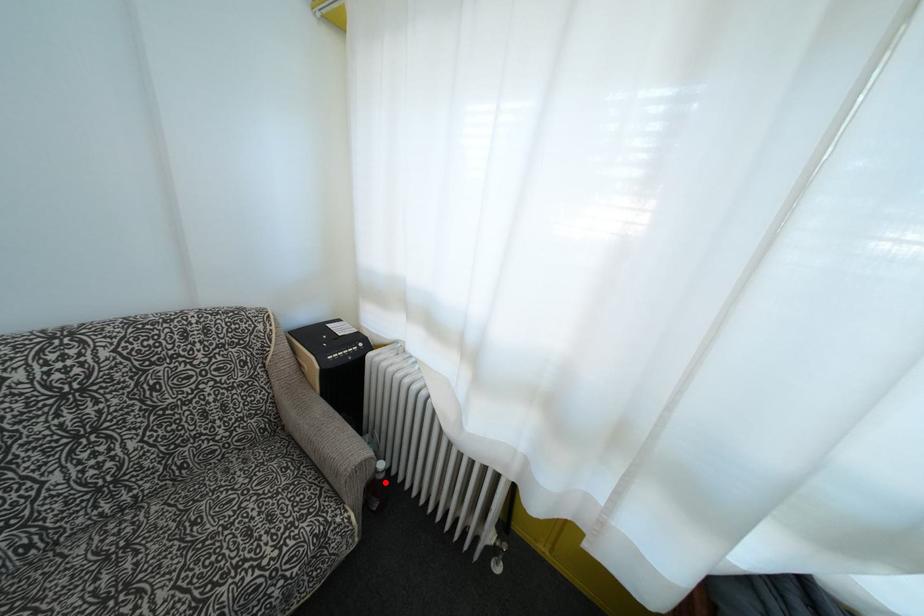
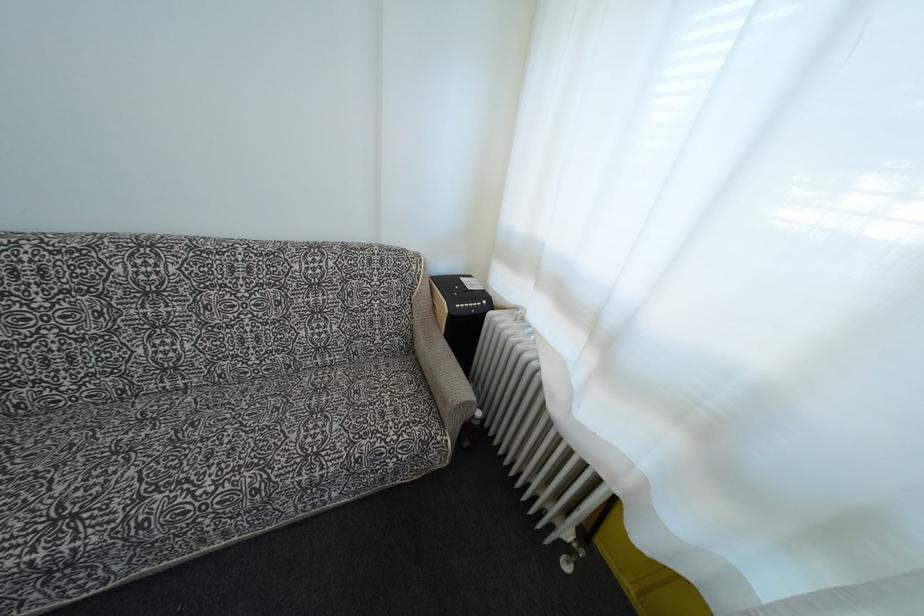
In the second image, find the point that corresponds to the highlighted location in the first image.

(480, 429)